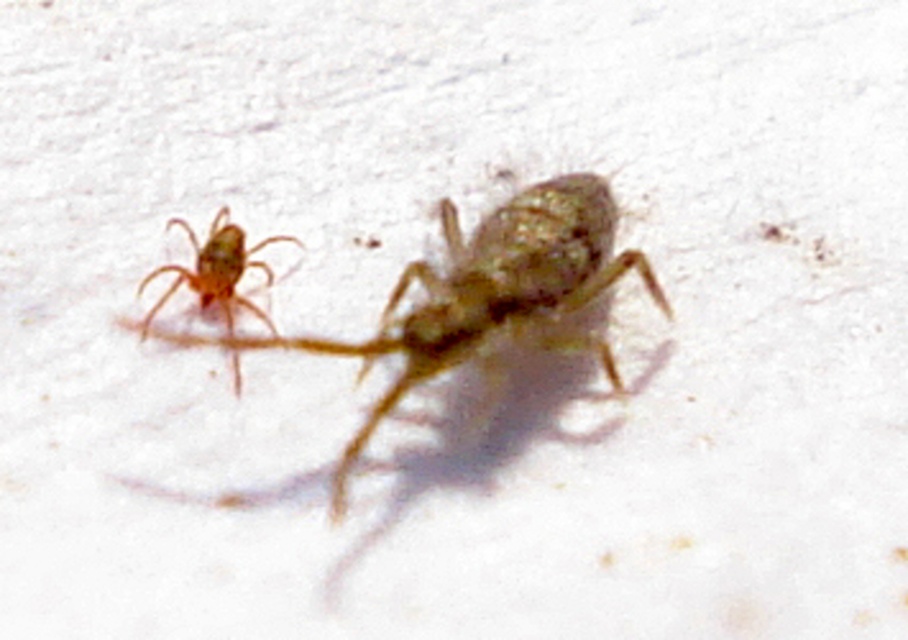
You are a researcher studying the positioning of arachnids in their environment. You have a grid overlay on the image with coordinates from 0 to 1 on both axes. You need to locate the translucent brown bug at center. What are its coordinates?

The translucent brown bug at center is located at coordinates point (487, 298).

Consider the image. You are a scientist observing two arachnids on a white surface. You need to determine their positions relative to each other. Which of the two, the translucent brown bug at center or the translucent amber spider at left, is closer to you?

The translucent brown bug at center is closer to you because it is in front of the translucent amber spider at left.